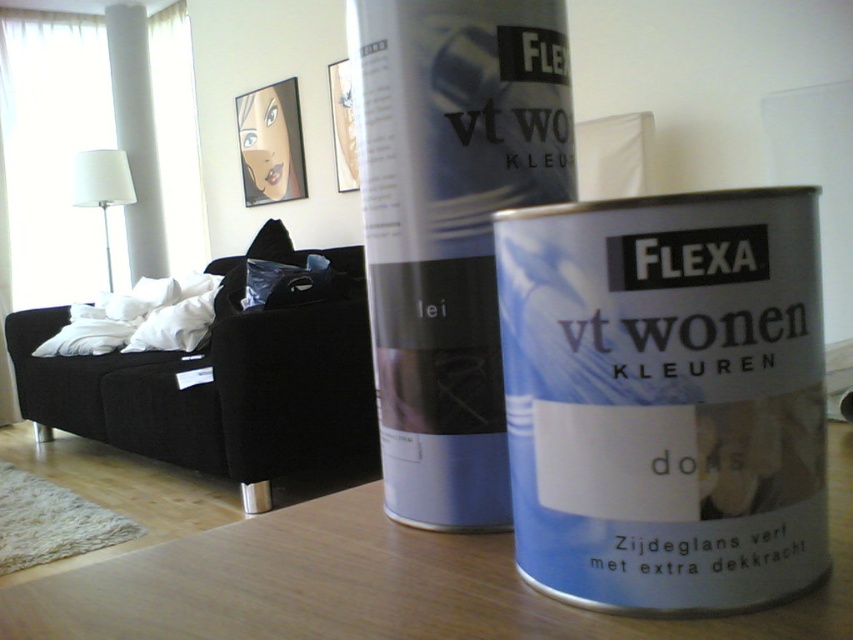
Is black fabric couch at left bigger than white fabric lampshade at upper left?

Correct, black fabric couch at left is larger in size than white fabric lampshade at upper left.

Can you confirm if black fabric couch at left is positioned below white fabric lampshade at upper left?

Correct, black fabric couch at left is located below white fabric lampshade at upper left.

Between point (138, 387) and point (114, 179), which one is positioned in front?

Point (138, 387) is more forward.

Find the location of a particular element. black fabric couch at left is located at coordinates (223, 388).

Is matte silver paint can at center to the left of wooden table at center from the viewer's perspective?

Incorrect, matte silver paint can at center is not on the left side of wooden table at center.

Which is behind, point (395, 180) or point (344, 532)?

Point (344, 532)

Is point (439, 477) closer to viewer compared to point (479, 625)?

No, (439, 477) is behind (479, 625).

The width and height of the screenshot is (853, 640). In order to click on matte silver paint can at center in this screenshot , I will do `click(450, 228)`.

Between matte silver paint can at center and white fabric lampshade at upper left, which one is positioned lower?

matte silver paint can at center is lower down.

Which is behind, point (563, 76) or point (99, 193)?

Point (99, 193)

You are a GUI agent. You are given a task and a screenshot of the screen. Output one action in this format:
    pyautogui.click(x=<x>, y=<y>)
    Task: Click on the matte silver paint can at center
    
    Given the screenshot: What is the action you would take?
    pyautogui.click(x=450, y=228)